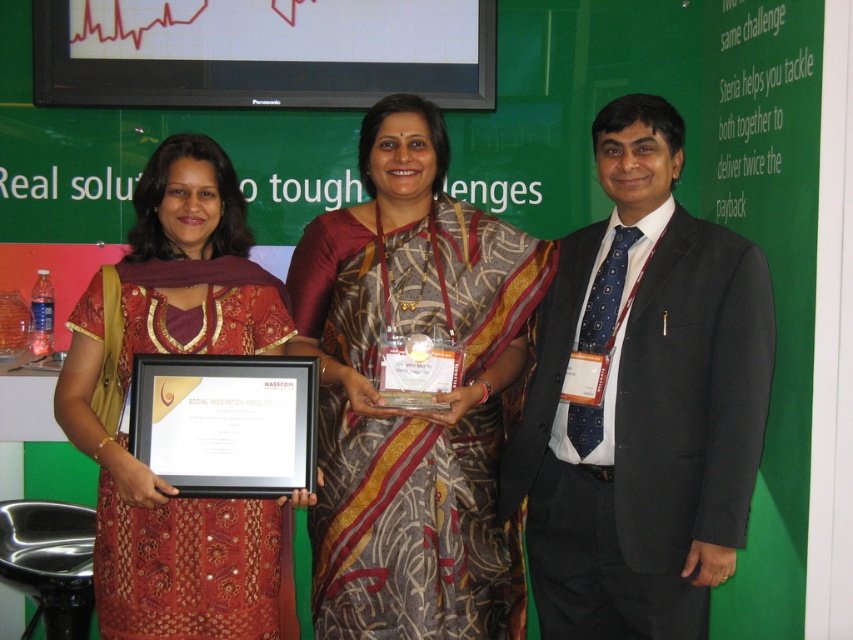
The image size is (853, 640). What do you see at coordinates (642, 401) in the screenshot?
I see `black suit at right` at bounding box center [642, 401].

Which is in front, point (711, 544) or point (398, 202)?

Point (711, 544)

Find the location of a particular element. black suit at right is located at coordinates (642, 401).

Between black suit at right and matte red dress at center, which one is positioned lower?

matte red dress at center

Who is more forward, (633, 289) or (160, 630)?

Point (160, 630) is in front.

Between point (660, 589) and point (283, 333), which one is positioned in front?

Point (660, 589) is more forward.

Locate an element on the screen. black suit at right is located at coordinates (642, 401).

Is printed silk saree at center smaller than matte red dress at center?

Yes.

In order to click on printed silk saree at center in this screenshot , I will do click(412, 410).

Find the location of `printed silk saree at center`. printed silk saree at center is located at coordinates (412, 410).